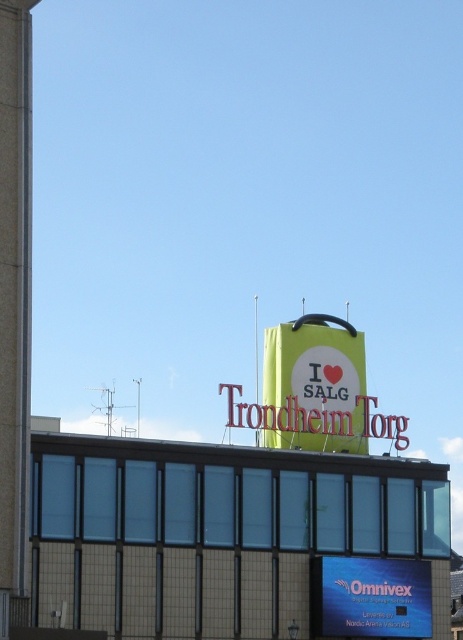
You are standing in front of the building and want to locate the point at coordinates (316,380). According to the scene description, where would this point be located?

The point at coordinates (316,380) is on the matte yellow sign at center.

You are a delivery person standing 5 meters away from the matte yellow sign at center. You need to place a package on the blue glossy sign at upper center. Can you reach it without moving closer than 5 meters?

The distance between the matte yellow sign at center and the blue glossy sign at upper center is 10.15 meters. Since you are already 5 meters away from the matte yellow sign at center, you would need to extend or throw the package an additional 5.15 meters to reach the blue glossy sign at upper center without moving closer. This may be challenging without additional equipment.

You are standing in front of a building and see the matte yellow sign at center and the blue glossy sign at upper center. Which one appears closer to you?

The matte yellow sign at center appears closer to you because it is further to the viewer than the blue glossy sign at upper center.